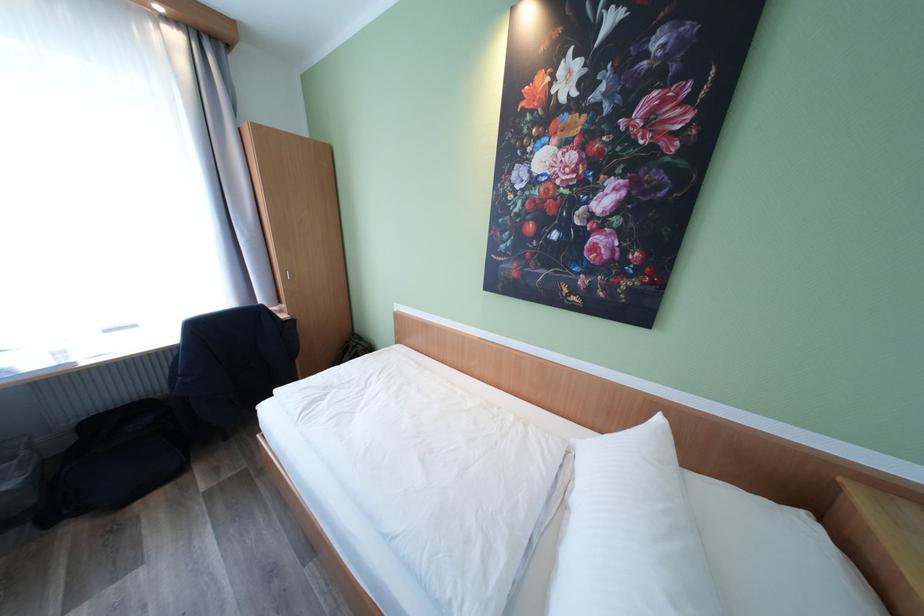
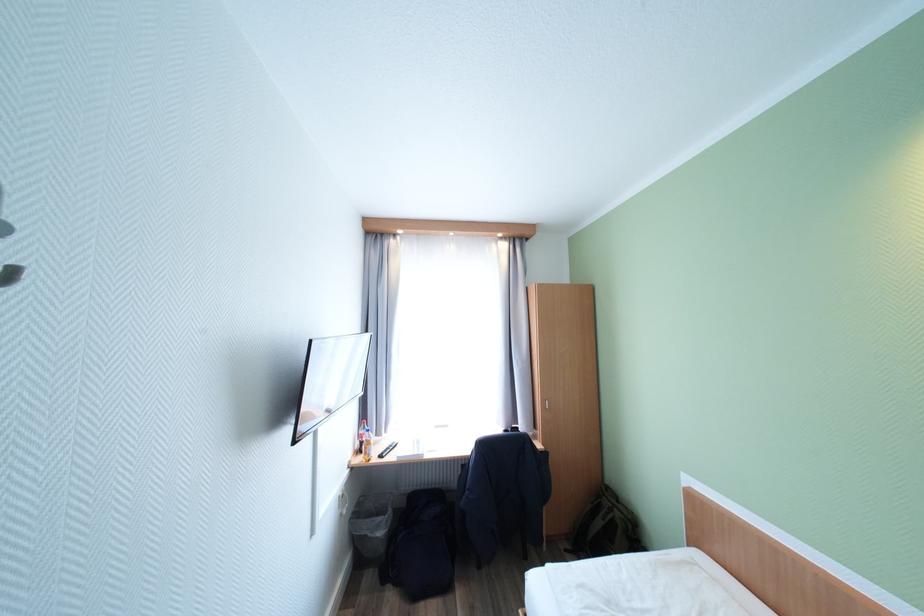
Find the pixel in the second image that matches point (361, 345) in the first image.

(617, 506)